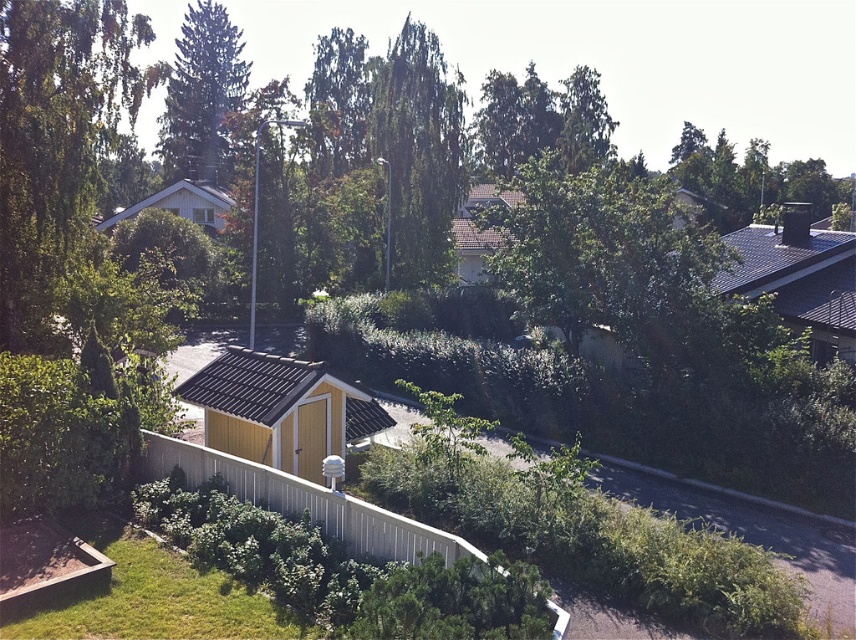
In the scene shown: You are standing at the center of the paved road in the middle ground. Looking towards the green leafy tree at upper left, which direction should you face to see it?

The green leafy tree at upper left is located at point (x=56, y=141), which is in the upper left direction from your position at the center of the paved road. Therefore, you should face towards the upper left to see it.

You are standing at the point marked as point (56, 141) in this suburban scene. What object is located at that point?

The point (56, 141) corresponds to the green leafy tree at upper left.

You are standing at the entrance of the yellow shed near the white picket fence. You want to walk to the green leafy tree at center. Which direction should you head relative to your current position?

The green leafy tree at center is located at point [418,154], so you should head towards the center of the image from your position near the yellow shed at the foreground.